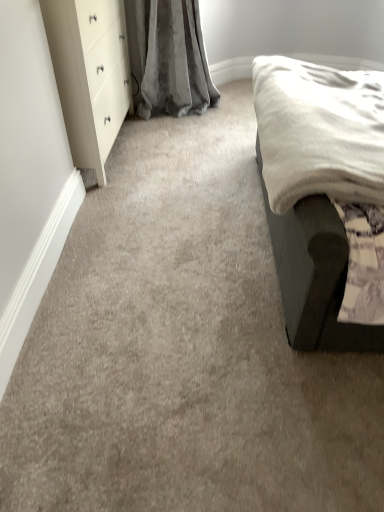
Where is `dark gray fabric bed at right`? The width and height of the screenshot is (384, 512). dark gray fabric bed at right is located at coordinates (308, 267).

Describe the element at coordinates (308, 267) in the screenshot. This screenshot has width=384, height=512. I see `dark gray fabric bed at right` at that location.

The height and width of the screenshot is (512, 384). What do you see at coordinates (90, 74) in the screenshot?
I see `white glossy dresser at upper left` at bounding box center [90, 74].

Measure the distance between point (122,113) and camera.

A distance of 2.56 meters exists between point (122,113) and camera.

Where is `white glossy dresser at upper left`? white glossy dresser at upper left is located at coordinates (90, 74).

I want to click on dark gray fabric bed at right, so click(x=308, y=267).

Based on the photo, in the image, is dark gray fabric bed at right on the left side or the right side of white glossy dresser at upper left?

Based on their positions, dark gray fabric bed at right is located to the right of white glossy dresser at upper left.

Is dark gray fabric bed at right behind white glossy dresser at upper left?

No, dark gray fabric bed at right is in front of white glossy dresser at upper left.

Is point (322, 265) closer or farther from the camera than point (103, 12)?

Point (322, 265).

From the picture: From the image's perspective, which one is positioned higher, dark gray fabric bed at right or white glossy dresser at upper left?

white glossy dresser at upper left, from the image's perspective.

From a real-world perspective, which object rests below the other?

From a 3D spatial view, white glossy dresser at upper left is below.

Which object is wider, dark gray fabric bed at right or white glossy dresser at upper left?

Wider between the two is dark gray fabric bed at right.

In terms of height, does dark gray fabric bed at right look taller or shorter compared to white glossy dresser at upper left?

In the image, dark gray fabric bed at right appears to be taller than white glossy dresser at upper left.

Does dark gray fabric bed at right have a smaller size compared to white glossy dresser at upper left?

No.

Looking at this image, is dark gray fabric bed at right inside or outside of white glossy dresser at upper left?

dark gray fabric bed at right is located beyond the bounds of white glossy dresser at upper left.

Are dark gray fabric bed at right and white glossy dresser at upper left far apart?

dark gray fabric bed at right is positioned a significant distance from white glossy dresser at upper left.

Is dark gray fabric bed at right facing towards white glossy dresser at upper left?

Yes.

How different are the orientations of dark gray fabric bed at right and white glossy dresser at upper left in degrees?

They differ by 178 degrees in their facing directions.

How far apart are dark gray fabric bed at right and white glossy dresser at upper left?

A distance of 1.21 meters exists between dark gray fabric bed at right and white glossy dresser at upper left.

Find the location of `the chest of drawers below the dark gray fabric bed at right (from a real-world perspective)`. the chest of drawers below the dark gray fabric bed at right (from a real-world perspective) is located at coordinates (90, 74).

Considering the relative positions of white glossy dresser at upper left and dark gray fabric bed at right in the image provided, is white glossy dresser at upper left to the right of dark gray fabric bed at right from the viewer's perspective?

Incorrect, white glossy dresser at upper left is not on the right side of dark gray fabric bed at right.

Consider the image. Which is behind, white glossy dresser at upper left or dark gray fabric bed at right?

white glossy dresser at upper left.

Does point (101, 127) appear closer or farther from the camera than point (290, 228)?

Point (101, 127) appears to be farther away from the viewer than point (290, 228).

From the image's perspective, which is above, white glossy dresser at upper left or dark gray fabric bed at right?

From the image's view, white glossy dresser at upper left is above.

From a real-world perspective, is white glossy dresser at upper left below dark gray fabric bed at right?

Yes, from a real-world perspective, white glossy dresser at upper left is below dark gray fabric bed at right.

From the picture: Is white glossy dresser at upper left wider than dark gray fabric bed at right?

In fact, white glossy dresser at upper left might be narrower than dark gray fabric bed at right.

Which of these two, white glossy dresser at upper left or dark gray fabric bed at right, stands shorter?

white glossy dresser at upper left is shorter.

Who is smaller, white glossy dresser at upper left or dark gray fabric bed at right?

white glossy dresser at upper left is smaller.

Which is correct: white glossy dresser at upper left is inside dark gray fabric bed at right, or outside of it?

white glossy dresser at upper left is not enclosed by dark gray fabric bed at right.

Is white glossy dresser at upper left beside dark gray fabric bed at right?

There is a gap between white glossy dresser at upper left and dark gray fabric bed at right.

Is white glossy dresser at upper left looking in the opposite direction of dark gray fabric bed at right?

No, white glossy dresser at upper left's orientation is not away from dark gray fabric bed at right.

How many degrees apart are the facing directions of white glossy dresser at upper left and dark gray fabric bed at right?

They differ by 178 degrees in their facing directions.

Find the location of a particular element. This screenshot has width=384, height=512. furniture in front of the white glossy dresser at upper left is located at coordinates (308, 267).

Identify the location of furniture that is above the white glossy dresser at upper left (from a real-world perspective). (308, 267).

I want to click on chest of drawers lying on the left of dark gray fabric bed at right, so click(90, 74).